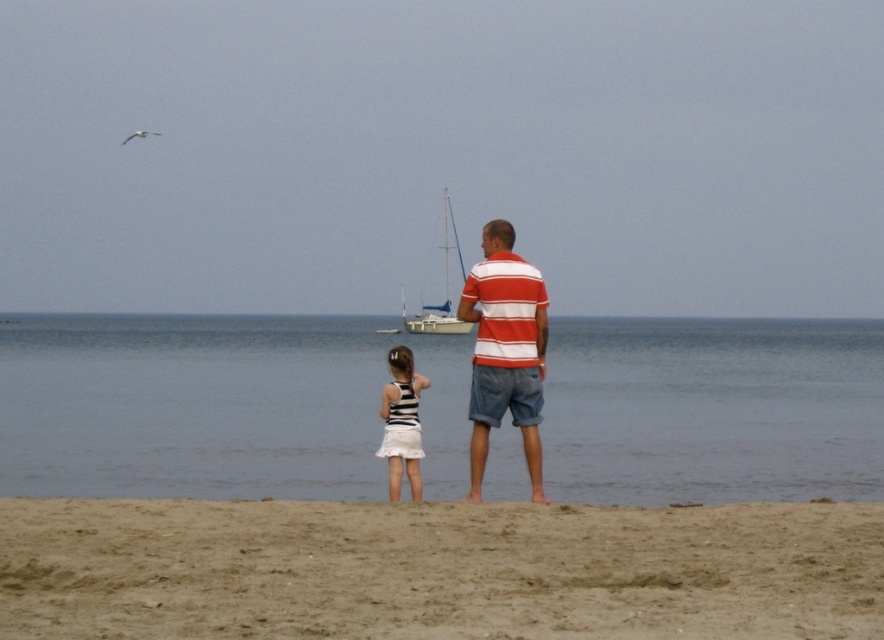
You are a photographer trying to capture a wide shot of the blue water at center and the striped fabric dress at center in the beach scene. Based on their widths, which object should you frame first to ensure both are fully visible in the photo?

The blue water at center is wider than the striped fabric dress at center, so you should frame the blue water at center first to ensure both are fully visible in the photo.

You are standing at point (158,522) and want to reach the sailboat anchored near the center of the water. The distance between you and the sailboat is 11.52 meters. Can you swim to it without needing to walk further?

The distance between you and the sailboat is 11.52 meters, so yes, you can swim to it without needing to walk further as the distance is manageable for swimming.

You are a photographer trying to capture a photo of the striped fabric dress at center and the blue water at center. Which object will occupy more space in your photo?

The blue water at center has a larger size compared to the striped fabric dress at center, so it will occupy more space in the photo.